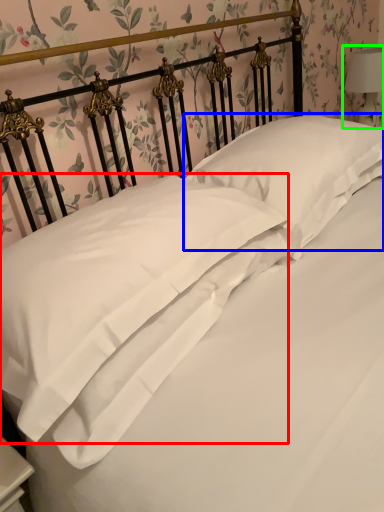
Question: Which object is positioned farthest from pillow (highlighted by a red box)? Select from pillow (highlighted by a blue box) and bedside lamp (highlighted by a green box).

Choices:
 (A) pillow
 (B) bedside lamp

Answer: (B)